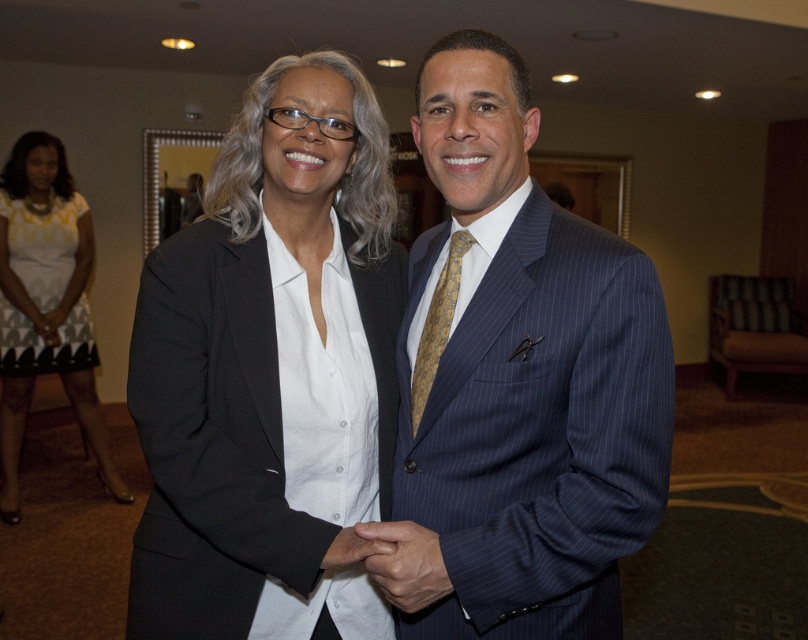
You are a photographer standing at the camera position. You want to adjust your zoom lens to capture the white dotted dress at lower left in the frame. The dress is 3.28 meters away from the camera. What is the minimum focal length required to fill the frame with the dress if the dress is 0.5 meters wide and your camera has a sensor width of 24mm? Assume the dress should occupy 80 percent of the sensor width for optimal framing.

To calculate the minimum focal length required, use the formula Focal Length mm x 0.03937 x 1000 divided by distance in meters. Plugging in the values, 24mm sensor width x 0.80 for 80 percent coverage equals 19.2mm. The dress width is 0.5 meters, so 19.2mm x 0.5 meters divided by 3.28 meters distance gives approximately 2.93mm. However, this result seems too small for a typical camera lens. Perhaps there was a miscalculation. Let me recalculate using the correct formula for focal length needed to frame an 0